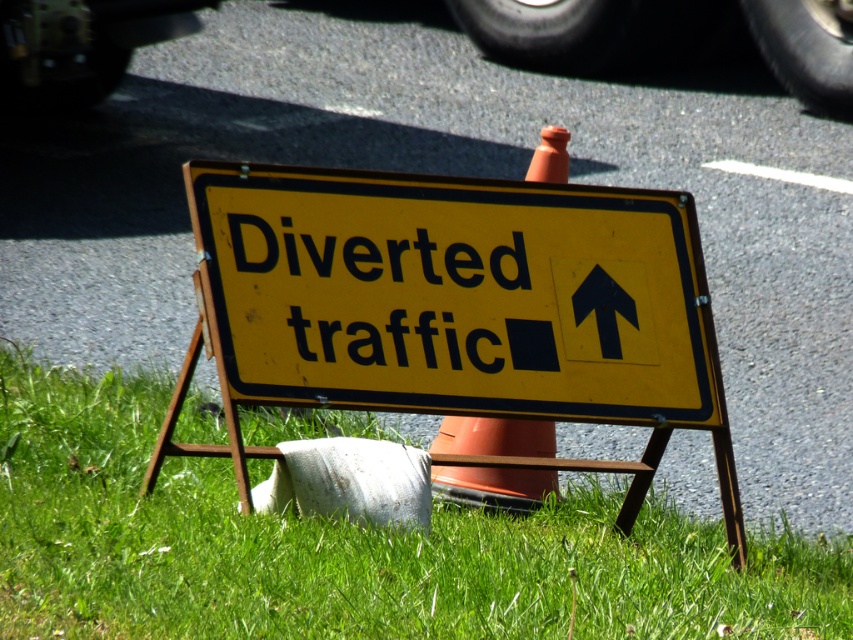
You are a delivery driver who needs to park your vehicle near the orange plastic traffic cone at center. The parking space requires at least 1.5 meters of clearance from the green grass at lower left. Can you safely park your vehicle in this location?

The green grass at lower left and orange plastic traffic cone at center are 1.23 meters apart, which is less than the required 1.5 meters clearance. Therefore, you cannot safely park your vehicle here as it would not meet the parking space requirements.

You are a pedestrian trying to cross the road near the sign. You see the black rubber tire at upper center and the orange plastic traffic cone at center. Which object is higher up in the image?

The black rubber tire at upper center is above the orange plastic traffic cone at center, so the black rubber tire at upper center is higher up in the image.